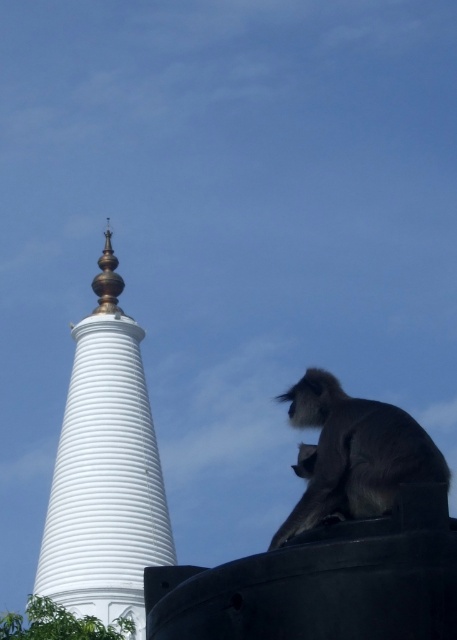
Is point (149, 444) closer to camera compared to point (365, 451)?

No, it is not.

Describe the element at coordinates (105, 470) in the screenshot. This screenshot has width=457, height=640. I see `white smooth stupa at left` at that location.

Does point (84, 598) lie in front of point (315, 468)?

No, it is behind (315, 468).

This screenshot has height=640, width=457. In order to click on white smooth stupa at left in this screenshot , I will do `click(105, 470)`.